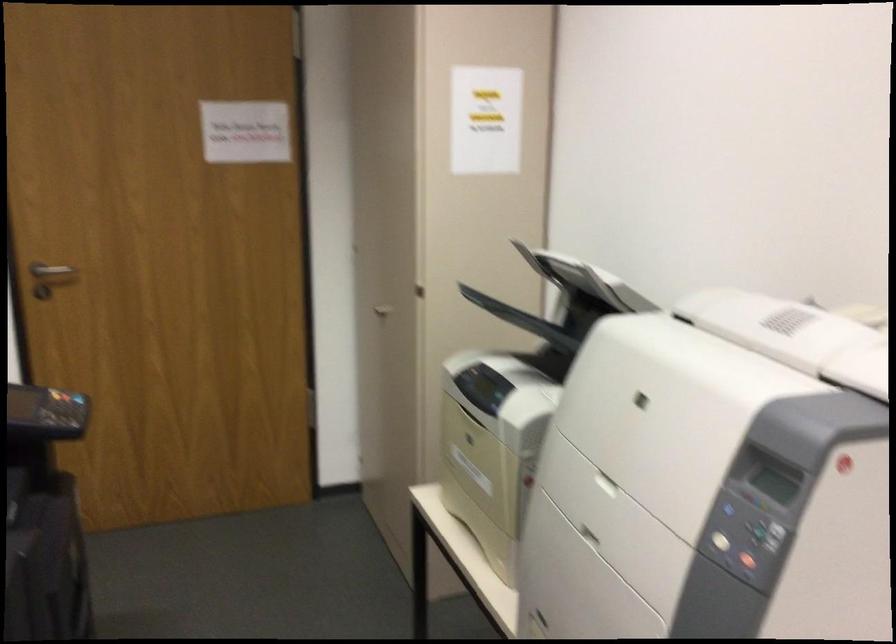
Identify the location of metal door handle. Image resolution: width=896 pixels, height=644 pixels. (52, 274).